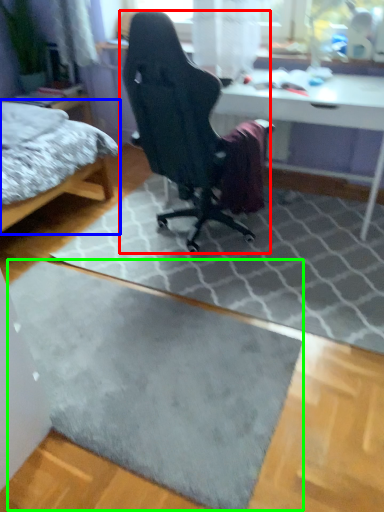
Question: Estimate the real-world distances between objects in this image. Which object is farther from chair (highlighted by a red box), bed (highlighted by a blue box) or doormat (highlighted by a green box)?

Choices:
 (A) bed
 (B) doormat

Answer: (B)